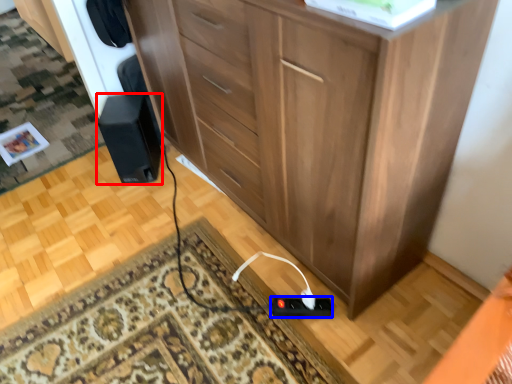
Question: Which of the following is the closest to the observer, speaker (highlighted by a red box) or plug (highlighted by a blue box)?

Choices:
 (A) speaker
 (B) plug

Answer: (B)